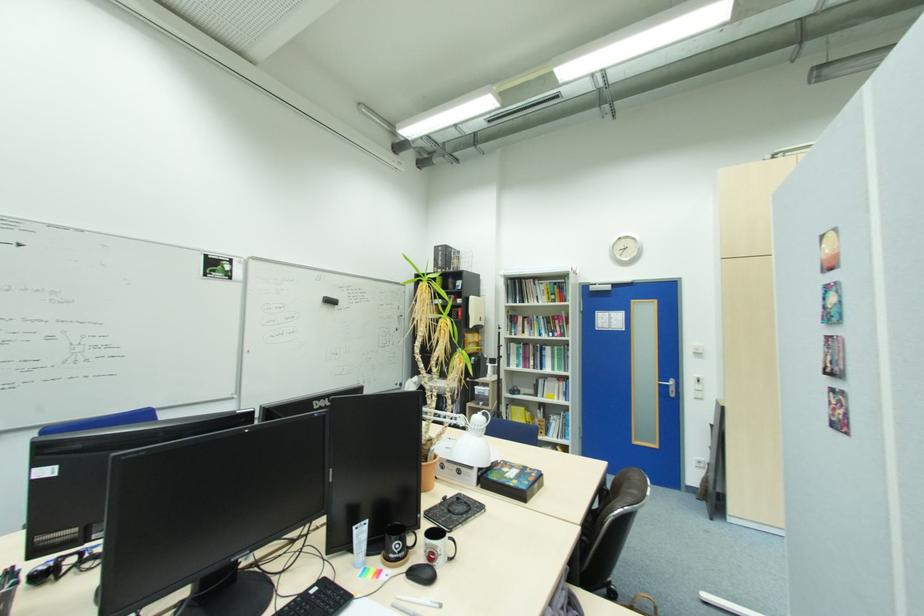
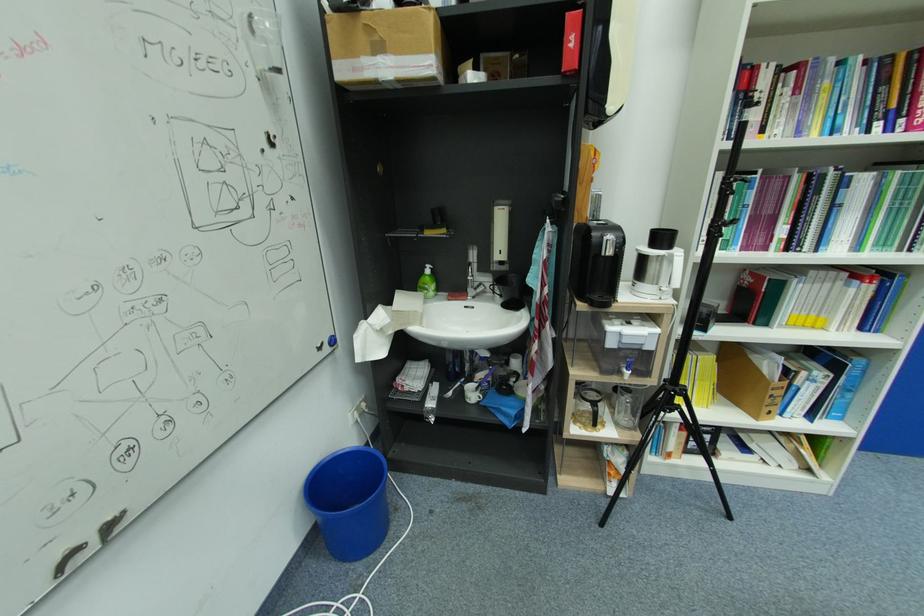
Locate, in the second image, the point that corresponds to (402,386) in the first image.

(330, 346)